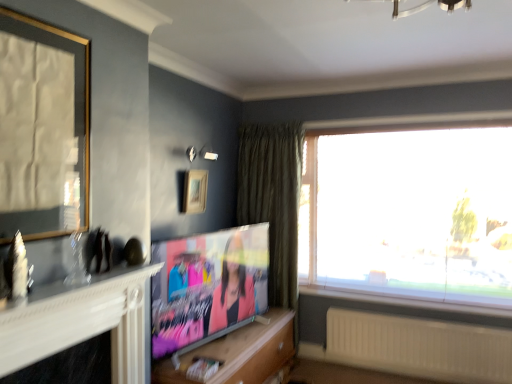
This screenshot has width=512, height=384. What are the coordinates of `vacant space situated above wooden cabinet at center (from a real-world perspective)` in the screenshot? It's located at (239, 345).